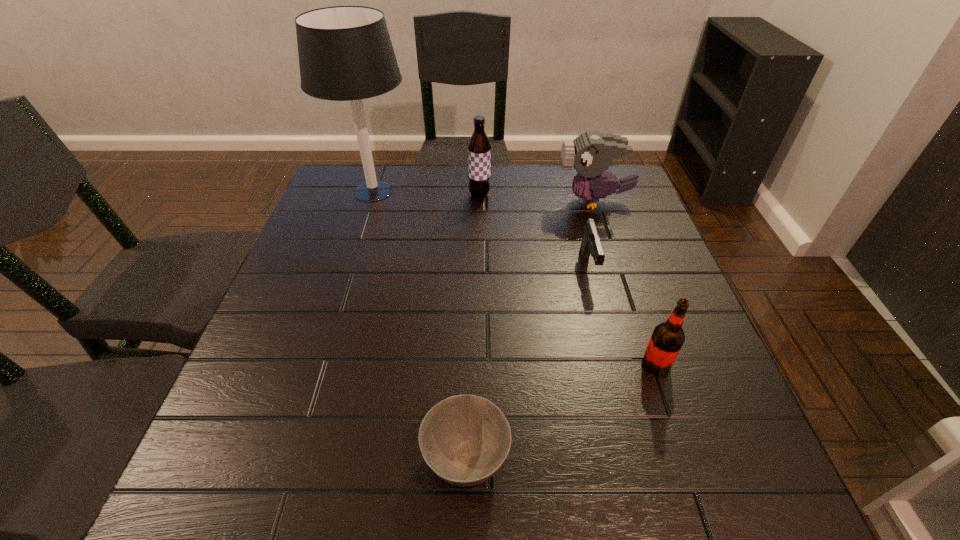
Find the location of a particular element. This screenshot has height=540, width=960. bowl is located at coordinates (465, 439).

You are a GUI agent. You are given a task and a screenshot of the screen. Output one action in this format:
    pyautogui.click(x=<x>, y=<y>)
    Task: Click on the vacant space situated on the front of the table lamp
    
    Given the screenshot: What is the action you would take?
    pyautogui.click(x=359, y=237)

Locate an element on the screen. This screenshot has width=960, height=540. vacant space located 0.270m on the left of the left root beer is located at coordinates (375, 195).

Find the location of `vacant region located at the beak of the bird`. vacant region located at the beak of the bird is located at coordinates (451, 201).

Find the location of a particular element. The height and width of the screenshot is (540, 960). free space located 0.070m at the beak of the bird is located at coordinates (532, 201).

The width and height of the screenshot is (960, 540). I want to click on vacant area situated 0.120m at the beak of the bird, so click(515, 201).

Where is `vacant point located 0.320m on the left of the nearer root beer`? The width and height of the screenshot is (960, 540). vacant point located 0.320m on the left of the nearer root beer is located at coordinates (478, 364).

I want to click on free space located 0.110m aim along the barrel of the fifth tallest object, so click(604, 324).

Where is `vacant area located 0.130m on the left of the bowl`? Image resolution: width=960 pixels, height=540 pixels. vacant area located 0.130m on the left of the bowl is located at coordinates (344, 459).

Locate an element on the screen. This screenshot has height=540, width=960. table lamp that is at the far edge is located at coordinates (345, 53).